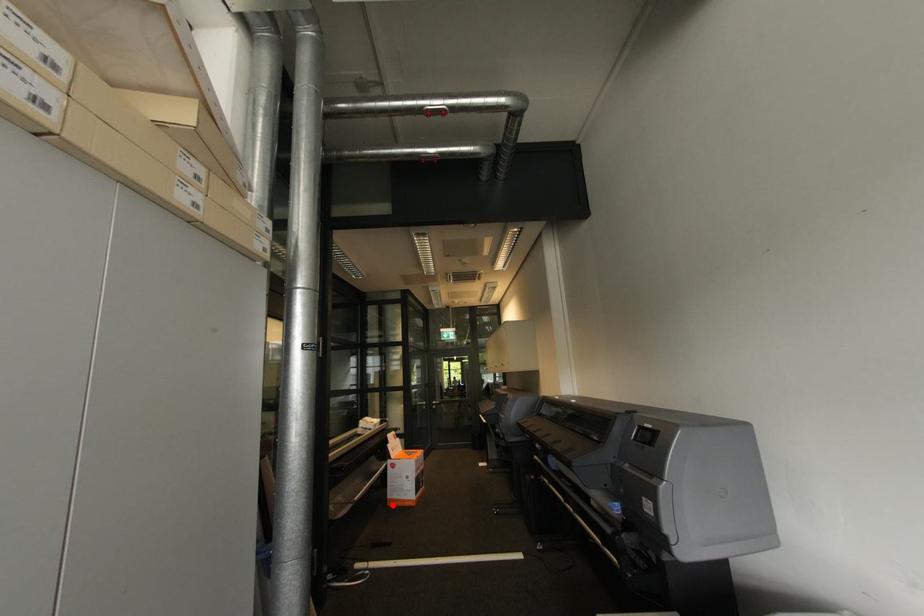
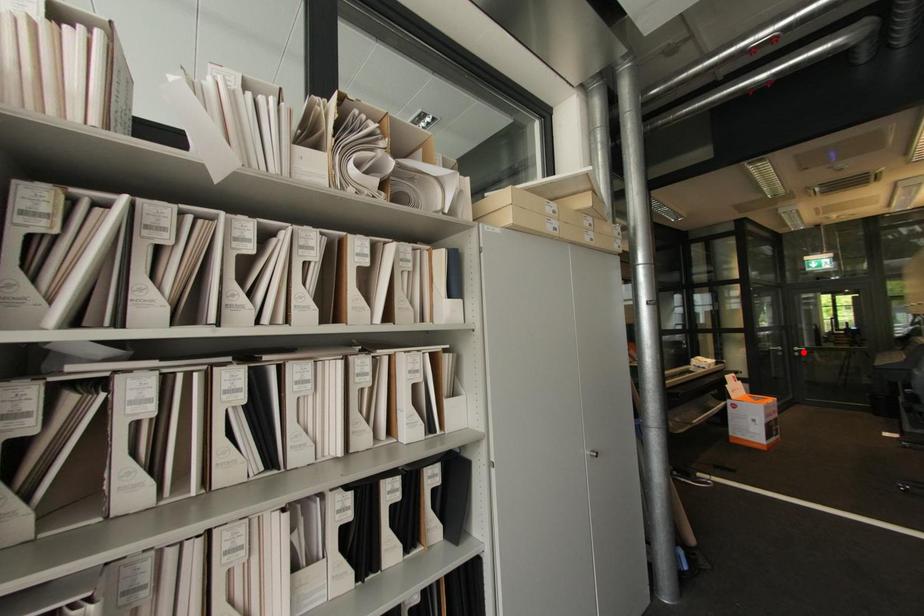
I am providing you with two images of the same scene from different viewpoints. A red point is marked on the first image and another point is marked on the second image. Does the point marked in image1 correspond to the same location as the one in image2?

No